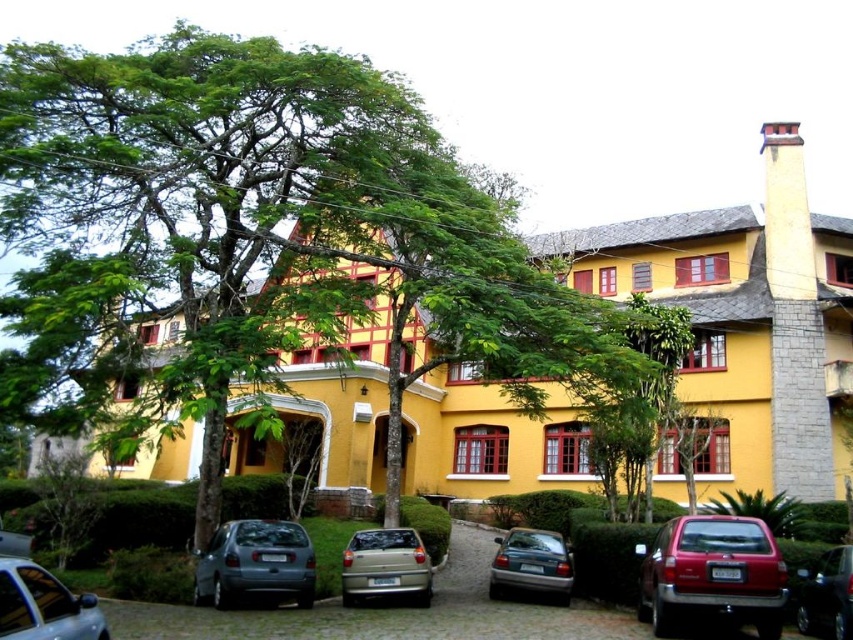
Between green leafy tree at center and metallic gray sedan at lower left, which one appears on the right side from the viewer's perspective?

green leafy tree at center

Between point (344, 120) and point (57, 620), which one is positioned in front?

Positioned in front is point (57, 620).

Find the location of a particular element. Image resolution: width=853 pixels, height=640 pixels. green leafy tree at center is located at coordinates (276, 228).

Does green leafy tree at center have a larger size compared to metallic gray car at center?

Correct, green leafy tree at center is larger in size than metallic gray car at center.

Between point (172, 129) and point (544, 632), which one is positioned in front?

Point (544, 632)

Between point (283, 211) and point (308, 529), which one is positioned behind?

The point (308, 529) is more distant.

The image size is (853, 640). Identify the location of green leafy tree at center. (276, 228).

Describe the element at coordinates (276, 228) in the screenshot. I see `green leafy tree at center` at that location.

Between point (160, 243) and point (643, 620), which one is positioned behind?

Point (160, 243)

You are a GUI agent. You are given a task and a screenshot of the screen. Output one action in this format:
    pyautogui.click(x=<x>, y=<y>)
    Task: Click on the green leafy tree at center
    Image resolution: width=853 pixels, height=640 pixels.
    Given the screenshot: What is the action you would take?
    pyautogui.click(x=276, y=228)